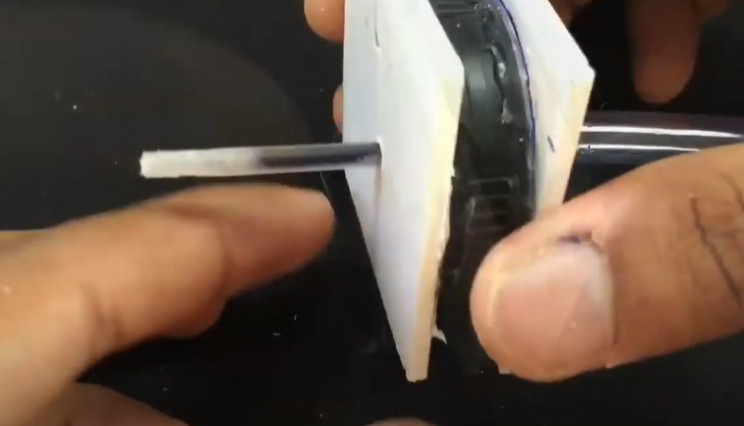
Locate an element on the screen. The height and width of the screenshot is (426, 744). fabric is located at coordinates (306, 354).